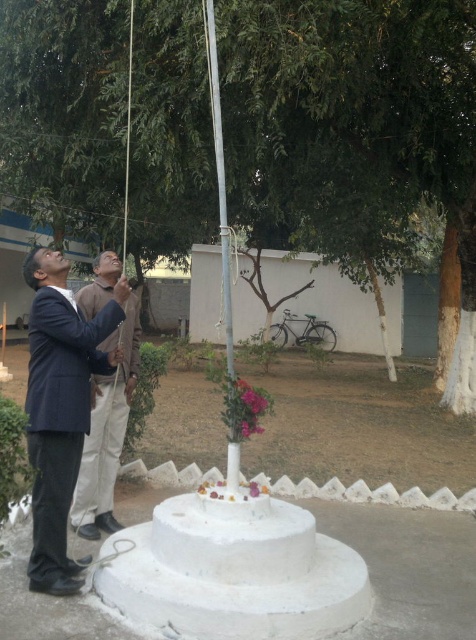
From the picture: You are standing at the camera position and want to take a photo of the green leafy tree at center. If your camera has a maximum zoom range of 10 feet, will you be able to capture the tree without moving closer?

The green leafy tree at center and camera are 21.28 feet apart, which exceeds the camera maximum zoom range of 10 feet. Therefore, you will not be able to capture the tree without moving closer.